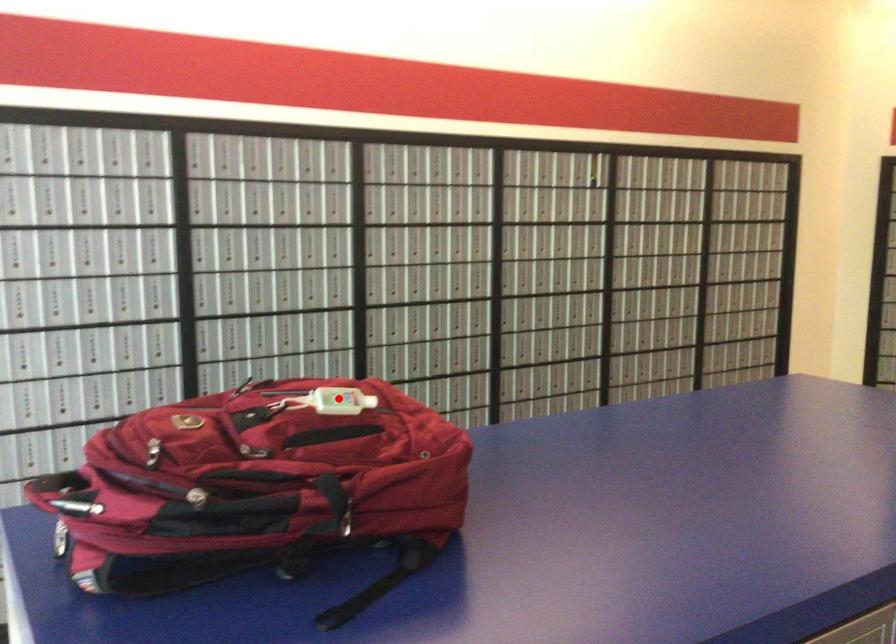
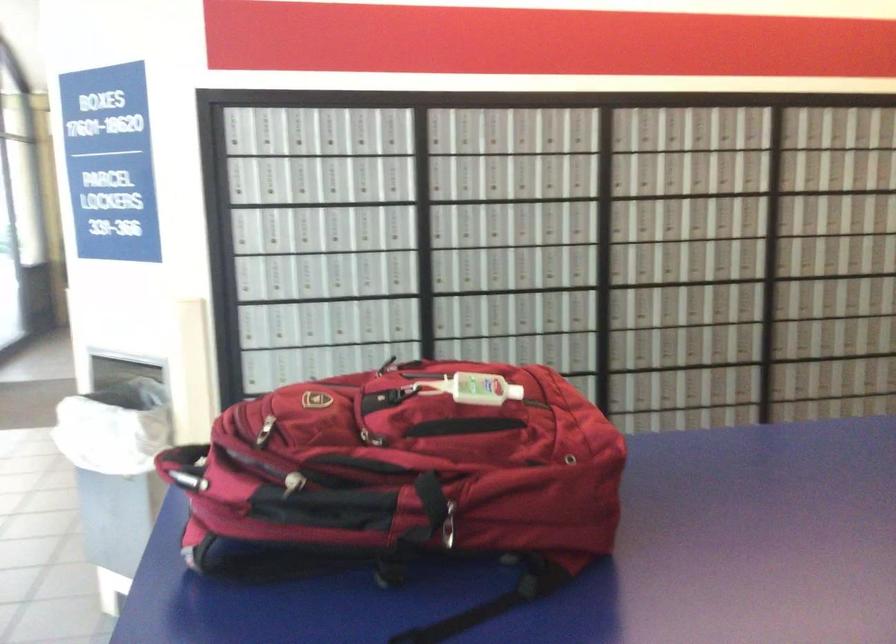
Question: I am providing you with two images of the same scene from different viewpoints. Image1 has a red point marked. In image2, the corresponding 3D location appears at what relative position? Reply with the corresponding letter.

Choices:
 (A) Closer
 (B) Farther

Answer: (A)